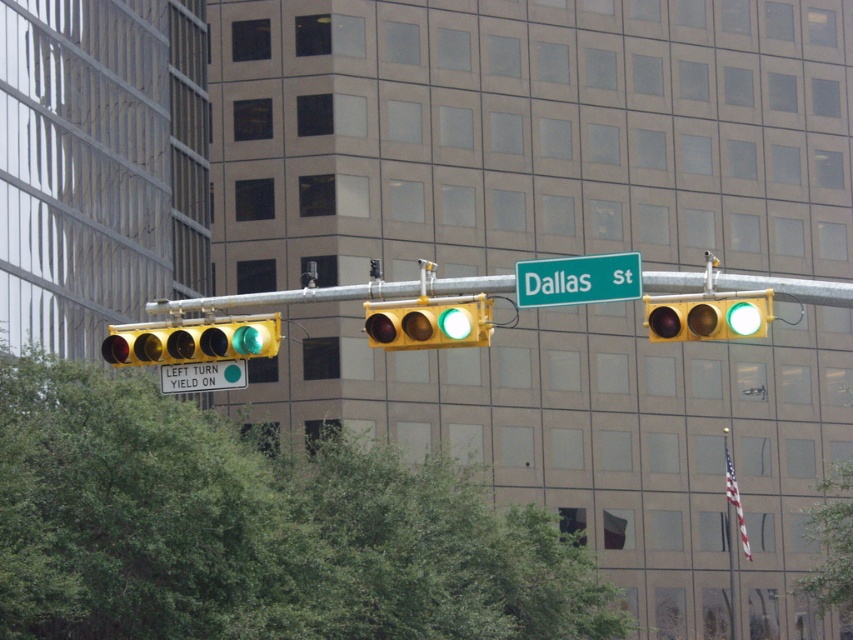
Is point (457, 278) farther from viewer compared to point (228, 387)?

No, (457, 278) is closer to viewer.

Between metallic silver pole at center and green matte sign at upper center, which one is positioned higher?

metallic silver pole at center is higher up.

Based on the photo, who is more forward, (850,289) or (192,381)?

Positioned in front is point (850,289).

Identify the location of metallic silver pole at center. (338, 292).

Does point (842, 468) come closer to viewer compared to point (483, 342)?

No, it is not.

Which is below, green leafy tree at center or yellow matte traffic light at center?

Positioned lower is green leafy tree at center.

What do you see at coordinates (831, 547) in the screenshot? The height and width of the screenshot is (640, 853). I see `green leafy tree at center` at bounding box center [831, 547].

Locate an element on the screen. This screenshot has width=853, height=640. green leafy tree at center is located at coordinates (831, 547).

Is yellow matte traffic light at left positioned at the back of yellow matte traffic light at center?

That is True.

Which is below, yellow matte traffic light at left or yellow matte traffic light at center?

yellow matte traffic light at left is lower down.

Describe the element at coordinates (192, 340) in the screenshot. I see `yellow matte traffic light at left` at that location.

Identify the location of yellow matte traffic light at left. (192, 340).